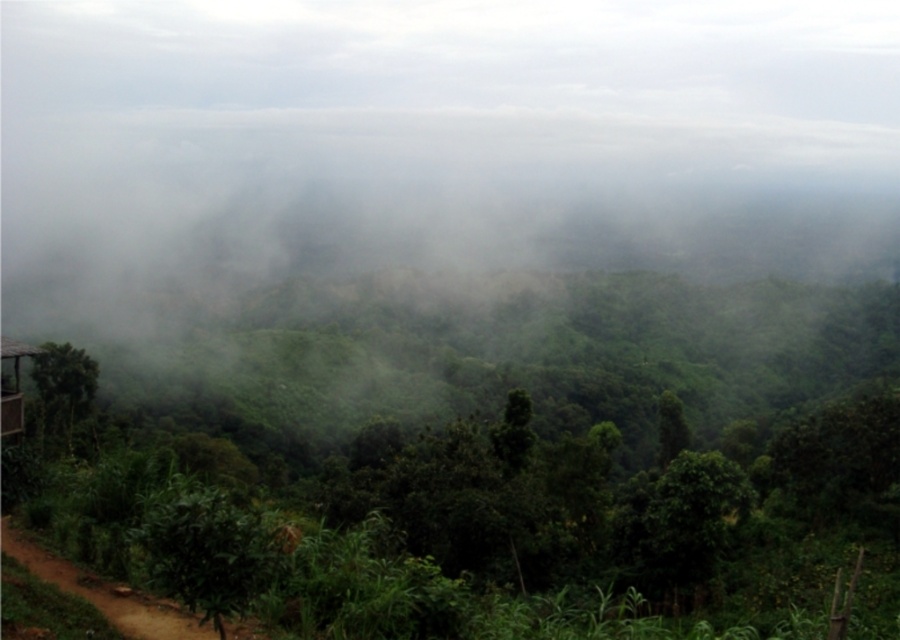
Between green matte fog at center and green leafy tree at lower left, which one has less height?

Standing shorter between the two is green leafy tree at lower left.

I want to click on green matte fog at center, so click(437, 140).

The width and height of the screenshot is (900, 640). What are the coordinates of `green matte fog at center` in the screenshot? It's located at tap(437, 140).

Which of these two, green leafy tree at lower left or green leafy tree at center, stands shorter?

With less height is green leafy tree at lower left.

You are a GUI agent. You are given a task and a screenshot of the screen. Output one action in this format:
    pyautogui.click(x=<x>, y=<y>)
    Task: Click on the green leafy tree at lower left
    
    Given the screenshot: What is the action you would take?
    pyautogui.click(x=63, y=387)

Can you confirm if green matte fog at center is bigger than green leafy tree at center?

Indeed, green matte fog at center has a larger size compared to green leafy tree at center.

Which is in front, point (68, 131) or point (659, 404)?

Point (659, 404)

Where is `green matte fog at center`? green matte fog at center is located at coordinates (437, 140).